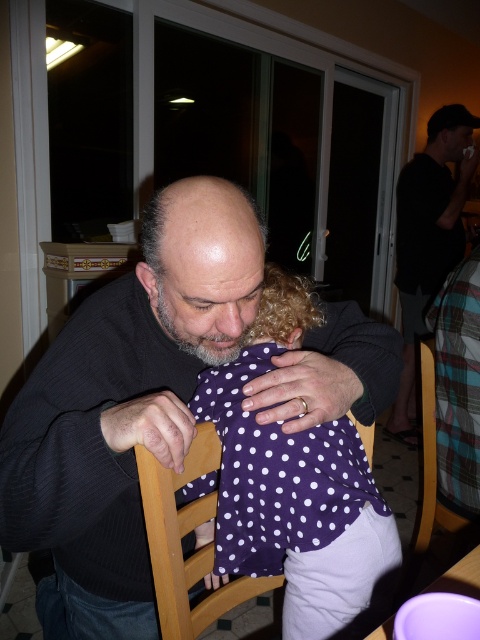
You are a photographer trying to capture a closeup of the matte black sweater at center and the purple dotted fabric at center. Which one should you focus on first to ensure both are in sharp focus?

The matte black sweater at center is closer to the viewer than the purple dotted fabric at center, so you should focus on the matte black sweater at center first to ensure both are in sharp focus.

You are a tailor measuring fabrics for a project. You need to determine which object, the black sweater at center or the purple plastic table at lower right, requires a larger piece of fabric for its surface area. Based on the scene, which one would need more fabric?

The black sweater at center has a greater width than the purple plastic table at lower right, so it would require a larger piece of fabric for its surface area.

You are a delivery robot that needs to deliver a package to the adult male with a bald head and a short beard wearing a dark long sleeved sweater. The package is placed at the point (39, 588). Can you reach him without moving the child?

The distance between the adult male with a bald head and a short beard wearing a dark long sleeved sweater and the point (39, 588) is 3.79 feet. Since the robot can move freely around the table, it can navigate to the adult male without disturbing the child as long as there is enough space between them.